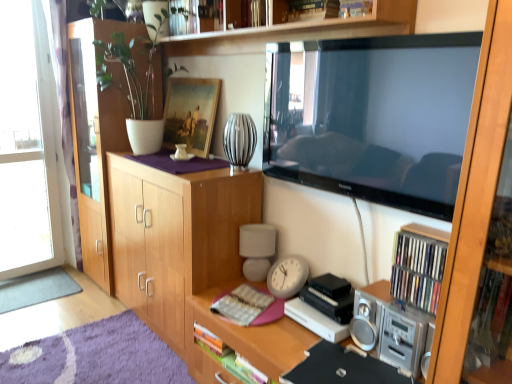
How much space does light brown wood cabinet at center, which is the 1th cabinetry from right to left, occupy vertically?

The height of light brown wood cabinet at center, which is the 1th cabinetry from right to left, is 1.02 meters.

I want to click on wooden cabinet at left, which is the 2th cabinetry in right-to-left order, so pyautogui.click(x=98, y=133).

This screenshot has height=384, width=512. Describe the element at coordinates (26, 146) in the screenshot. I see `transparent glass door at left` at that location.

What do you see at coordinates (390, 327) in the screenshot? I see `silver metallic stereo at lower right` at bounding box center [390, 327].

Locate an element on the screen. Image resolution: width=512 pixels, height=384 pixels. white matte lamp at center is located at coordinates (256, 249).

In order to click on light brown wood cabinet at center, which is counted as the 2th cabinetry, starting from the left in this screenshot , I will do `click(176, 237)`.

Does gray carpet at lower left come behind white matte lamp at center?

Yes, the depth of gray carpet at lower left is greater than that of white matte lamp at center.

In terms of height, does gray carpet at lower left look taller or shorter compared to white matte lamp at center?

Clearly, gray carpet at lower left is shorter compared to white matte lamp at center.

Can we say gray carpet at lower left lies outside white matte lamp at center?

Yes, gray carpet at lower left is not within white matte lamp at center.

Is gray carpet at lower left facing away from white matte lamp at center?

No, gray carpet at lower left is not facing the opposite direction of white matte lamp at center.

How different are the orientations of wooden at upper center and gray carpet at lower left in degrees?

They differ by 89.2 degrees in their facing directions.

Can you confirm if wooden at upper center is positioned to the left of gray carpet at lower left?

No, wooden at upper center is not to the left of gray carpet at lower left.

Is wooden at upper center in contact with gray carpet at lower left?

wooden at upper center and gray carpet at lower left are clearly separated.

Could you tell me if wooden at upper center is facing gray carpet at lower left?

No, wooden at upper center is not turned towards gray carpet at lower left.

Is hardcover book at center not inside wooden desk at center?

Actually, hardcover book at center is within wooden desk at center.

From the image's perspective, which one is positioned lower, hardcover book at center or wooden desk at center?

wooden desk at center appears lower in the image.

Is hardcover book at center facing towards wooden desk at center?

No, hardcover book at center is not oriented towards wooden desk at center.

Locate an element on the screen. The width and height of the screenshot is (512, 384). desk located in front of the hardcover book at center is located at coordinates (244, 339).

Would you say transparent glass door at left is part of wooden at upper center's contents?

Actually, transparent glass door at left is outside wooden at upper center.

Is wooden at upper center positioned with its back to transparent glass door at left?

No, wooden at upper center's orientation is not away from transparent glass door at left.

How far apart are wooden at upper center and transparent glass door at left?

The distance of wooden at upper center from transparent glass door at left is 1.50 meters.

Considering the relative sizes of wooden cabinet at left, which is the 2th cabinetry in right-to-left order, and wooden at upper center in the image provided, is wooden cabinet at left, which is the 2th cabinetry in right-to-left order, shorter than wooden at upper center?

In fact, wooden cabinet at left, which is the 2th cabinetry in right-to-left order, may be taller than wooden at upper center.

Who is bigger, wooden cabinet at left, which ranks as the first cabinetry in left-to-right order, or wooden at upper center?

Bigger between the two is wooden cabinet at left, which ranks as the first cabinetry in left-to-right order.

In terms of width, does wooden cabinet at left, which is the 2th cabinetry in right-to-left order, look wider or thinner when compared to wooden at upper center?

In the image, wooden cabinet at left, which is the 2th cabinetry in right-to-left order, appears to be wider than wooden at upper center.

From the image's perspective, does wooden cabinet at left, which ranks as the first cabinetry in left-to-right order, appear lower than wooden at upper center?

Yes, from the image's perspective, wooden cabinet at left, which ranks as the first cabinetry in left-to-right order, is below wooden at upper center.

You are a GUI agent. You are given a task and a screenshot of the screen. Output one action in this format:
    pyautogui.click(x=<x>, y=<y>)
    Task: Click on the 2nd cabinetry below when counting from the white ceramic vase at upper left (from the image's perspective)
    The width and height of the screenshot is (512, 384).
    Given the screenshot: What is the action you would take?
    pyautogui.click(x=176, y=237)

Considering the positions of objects light brown wood cabinet at center, which is counted as the 2th cabinetry, starting from the left, and white ceramic vase at upper left in the image provided, who is more to the left, light brown wood cabinet at center, which is counted as the 2th cabinetry, starting from the left, or white ceramic vase at upper left?

white ceramic vase at upper left.

Does light brown wood cabinet at center, which is counted as the 2th cabinetry, starting from the left, lie in front of white ceramic vase at upper left?

Yes, light brown wood cabinet at center, which is counted as the 2th cabinetry, starting from the left, is closer to the viewer.

From a real-world perspective, is light brown wood cabinet at center, which is the 1th cabinetry from right to left, positioned under white ceramic vase at upper left based on gravity?

Yes.

Can you confirm if silver metallic stereo at lower right is thinner than wooden at upper center?

No.

Is point (379, 305) closer to camera compared to point (221, 46)?

That is True.

Which object is further away from the camera taking this photo, silver metallic stereo at lower right or wooden at upper center?

silver metallic stereo at lower right is more distant.

Measure the distance between silver metallic stereo at lower right and wooden at upper center.

They are 3.89 feet apart.

The width and height of the screenshot is (512, 384). I want to click on plain behind the white matte lamp at center, so click(x=36, y=289).

In the image, there is a wooden at upper center. At what (x,y) coordinates should I click in order to perform the action: click on plain below it (from the image's perspective). Please return your answer as a coordinate pair (x, y). The height and width of the screenshot is (384, 512). Looking at the image, I should click on (36, 289).

Looking at the image, which one is located closer to wooden cabinet at left, which is the 2th cabinetry in right-to-left order, hardcover book at center or white matte lamp at center?

white matte lamp at center.

From the image, which object appears to be nearer to hardcover book at center, white matte lamp at center or wooden at upper center?

white matte lamp at center.

When comparing their distances from gray carpet at lower left, does wooden at upper center or silver metallic stereo at lower right seem closer?

wooden at upper center is positioned closer to the anchor gray carpet at lower left.

Considering their positions, is silver metallic stereo at lower right positioned closer to light brown wood cabinet at center, which is counted as the 2th cabinetry, starting from the left, than transparent glass door at left?

Among the two, silver metallic stereo at lower right is located nearer to light brown wood cabinet at center, which is counted as the 2th cabinetry, starting from the left.

Estimate the real-world distances between objects in this image. Which object is closer to wooden at upper center, wooden picture frame at upper center or light brown wood cabinet at center, which is the 1th cabinetry from right to left?

wooden picture frame at upper center.

From the image, which object appears to be nearer to hardcover book at center, wooden at upper center or wooden cabinet at left, which ranks as the first cabinetry in left-to-right order?

wooden at upper center is closer to hardcover book at center.

Which object lies further to the anchor point wooden desk at center, white ceramic vase at upper left or silver metallic stereo at lower right?

white ceramic vase at upper left is positioned further to the anchor wooden desk at center.

Looking at the image, which one is located further to gray carpet at lower left, silver metallic stereo at lower right or wooden picture frame at upper center?

Among the two, silver metallic stereo at lower right is located further to gray carpet at lower left.

Locate an element on the screen. This screenshot has height=384, width=512. picture frame that lies between wooden at upper center and white matte lamp at center from top to bottom is located at coordinates (190, 113).

At what (x,y) coordinates should I click in order to perform the action: click on picture frame between transparent glass door at left and white matte lamp at center from left to right. Please return your answer as a coordinate pair (x, y). Looking at the image, I should click on (190, 113).

I want to click on lamp situated between wooden cabinet at left, which ranks as the first cabinetry in left-to-right order, and silver metallic stereo at lower right from left to right, so click(256, 249).

Locate an element on the screen. cabinetry between transparent glass door at left and white ceramic vase at upper left is located at coordinates (98, 133).